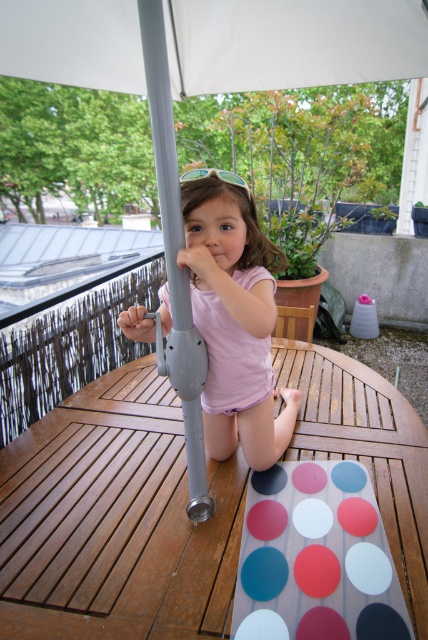
You are standing on the balcony and want to place a small plant pot on the wooden table at center. Given that the table has a transparent sheet with a grid of colorful circles, can you determine if the point marked as point (115, 520) on the grid is within the area of the wooden table at center?

The point (115, 520) marks the wooden table at center, so yes, placing the plant pot at that point would be within the table area.